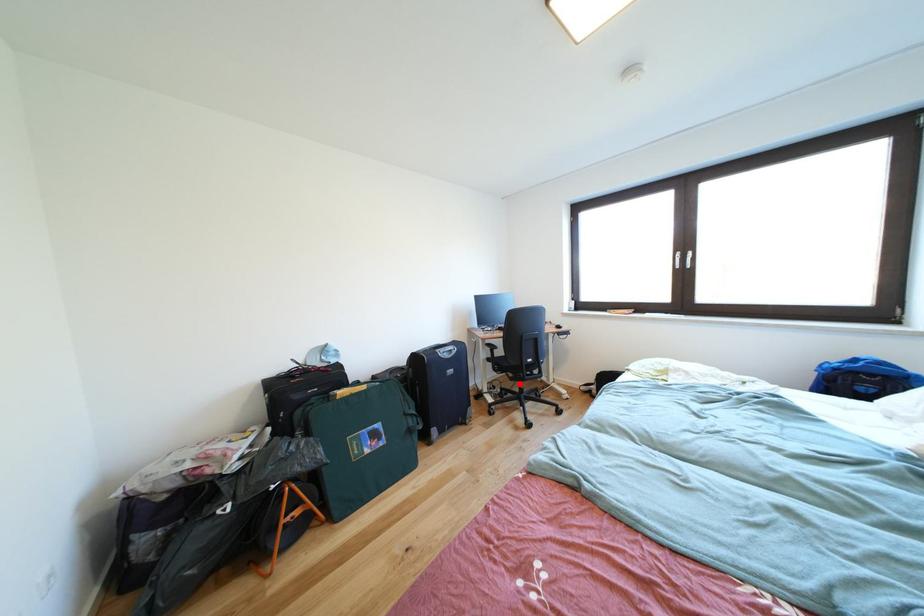
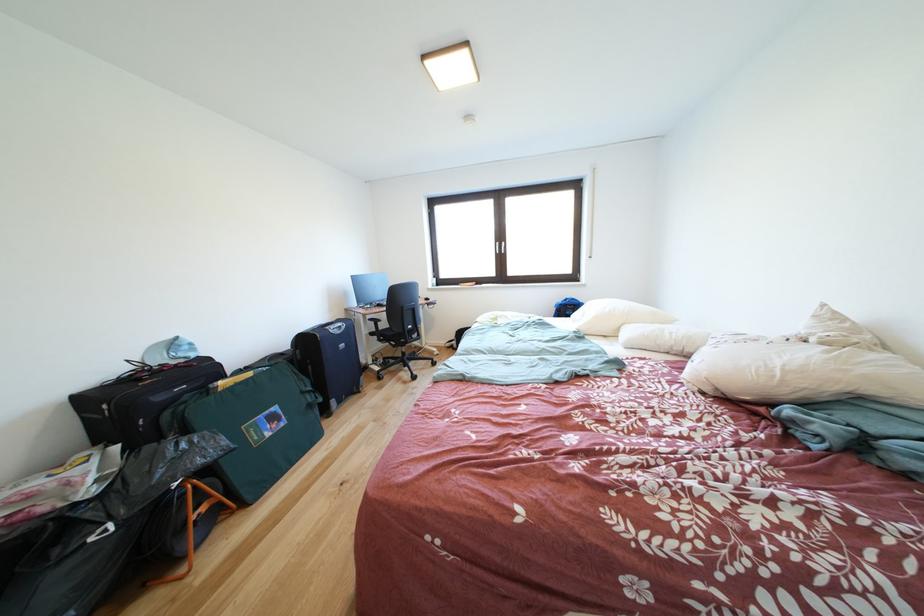
Question: I am providing you with two images of the same scene from different viewpoints. Given a red point in image1, look at the same physical point in image2. Is it:

Choices:
 (A) Closer to the viewpoint
 (B) Farther from the viewpoint

Answer: (A)